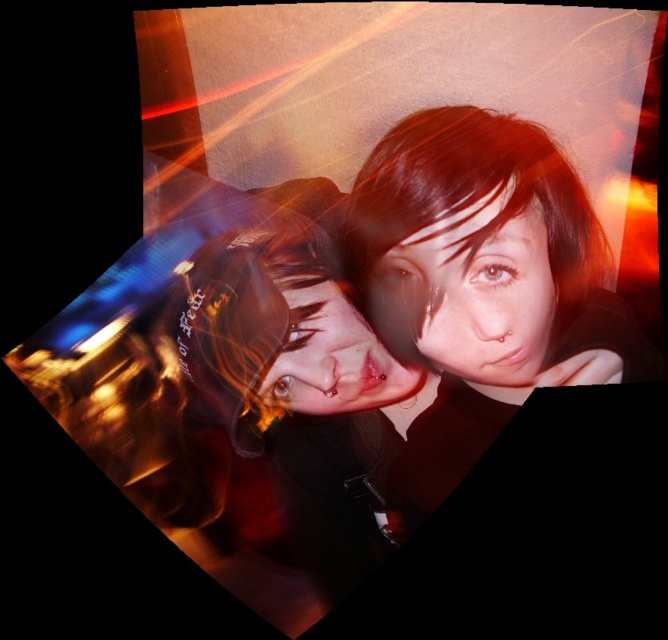
Does point (470, 376) lie in front of point (452, 292)?

No, (470, 376) is behind (452, 292).

Can you confirm if matte black hair at center is smaller than matte red hair at center?

Incorrect, matte black hair at center is not smaller in size than matte red hair at center.

The image size is (668, 640). Identify the location of matte black hair at center. [472, 243].

Identify the location of matte black hair at center. (472, 243).

Is matte red hair at center smaller than smooth skin face at center?

Actually, matte red hair at center might be larger than smooth skin face at center.

Between matte red hair at center and smooth skin face at center, which one has less height?

With less height is smooth skin face at center.

Is point (440, 364) positioned in front of point (293, 339)?

Yes.

Find the location of a particular element. The height and width of the screenshot is (640, 668). matte red hair at center is located at coordinates (470, 294).

Does matte black hair at center appear on the right side of smooth skin face at center?

Yes, matte black hair at center is to the right of smooth skin face at center.

Which is behind, point (482, 232) or point (301, 355)?

Positioned behind is point (301, 355).

I want to click on matte black hair at center, so click(472, 243).